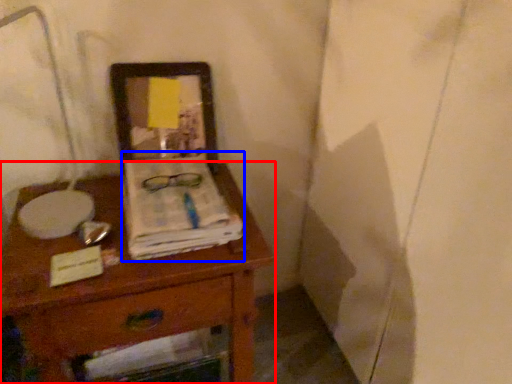
Question: Among these objects, which one is farthest to the camera, desk (highlighted by a red box) or magazine (highlighted by a blue box)?

Choices:
 (A) desk
 (B) magazine

Answer: (B)